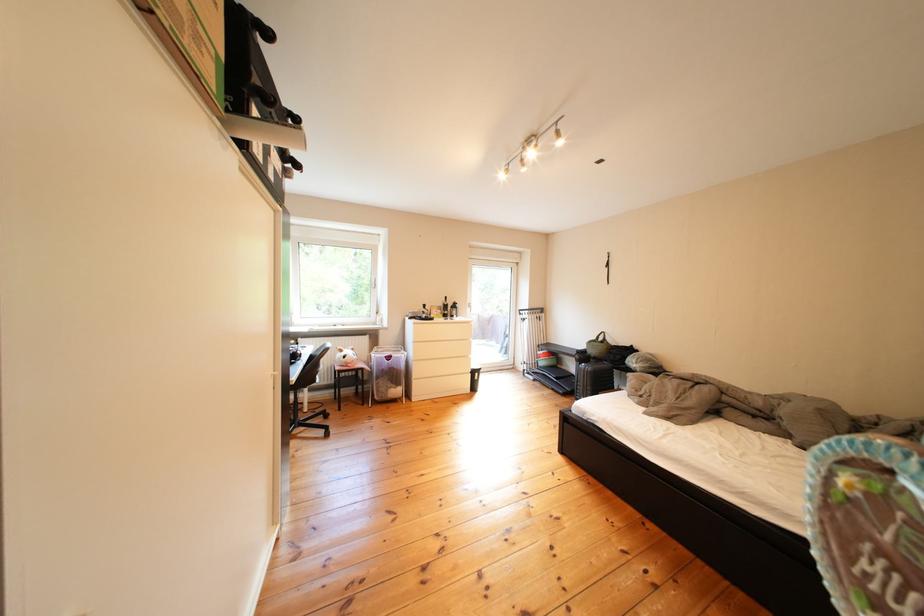
Find the location of a particular element. white window handle is located at coordinates (375, 282).